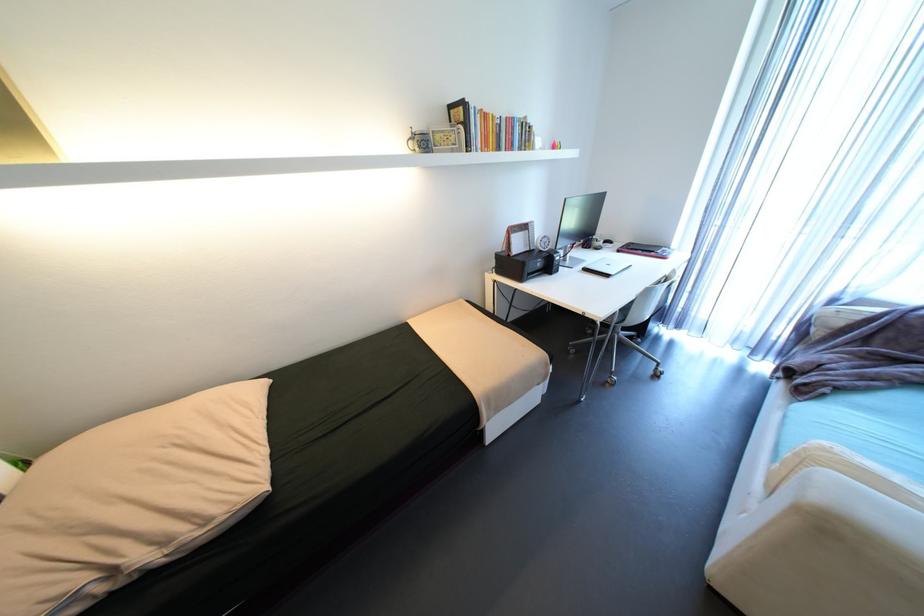
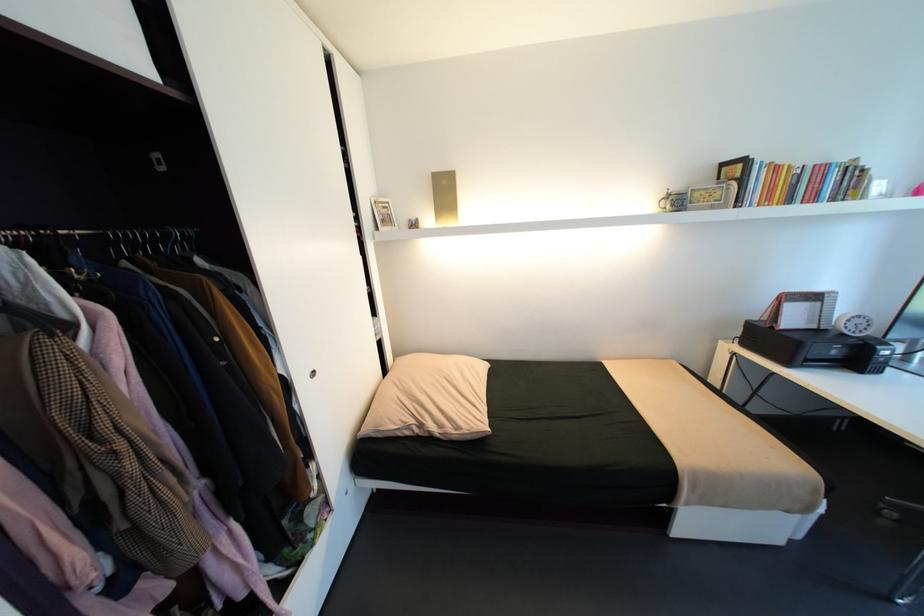
Where in the second image is the point corresponding to (x=514, y=118) from the first image?

(821, 166)